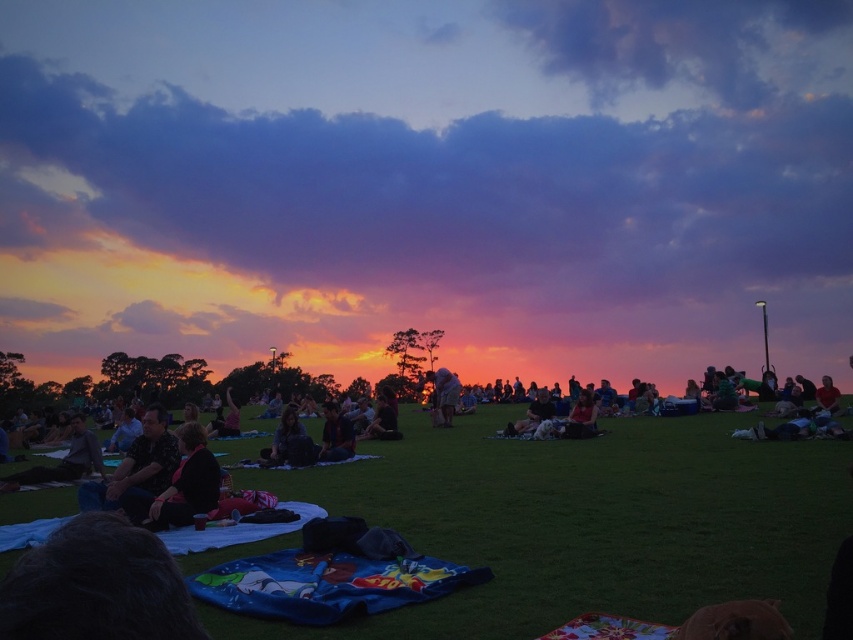
Is black fabric at center below matte black jacket at center?

No, black fabric at center is not below matte black jacket at center.

Between point (383, 412) and point (218, 420), which one is positioned behind?

The point (218, 420) is behind.

I want to click on black fabric at center, so click(x=383, y=419).

Which of these two, green grass at center or matte black jacket at center, stands shorter?

→ green grass at center

Is green grass at center above matte black jacket at center?

Answer: Indeed, green grass at center is positioned over matte black jacket at center.

Is point (12, 516) closer to camera compared to point (229, 428)?

Yes, it is.

Find the location of a particular element. green grass at center is located at coordinates (583, 522).

Does floral fabric blanket at lower left have a greater height compared to dark brown fabric at center?

Yes.

Between floral fabric blanket at lower left and dark brown fabric at center, which one appears on the right side from the viewer's perspective?

From the viewer's perspective, dark brown fabric at center appears more on the right side.

The width and height of the screenshot is (853, 640). Identify the location of floral fabric blanket at lower left. (136, 467).